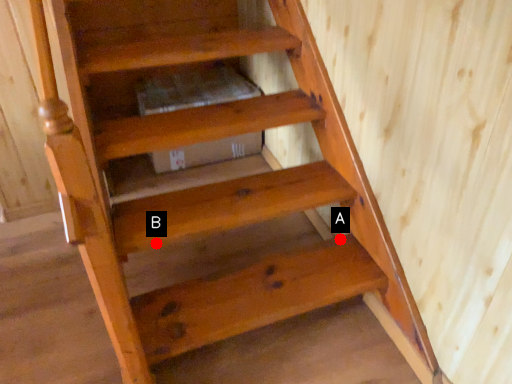
Question: Two points are circled on the image, labeled by A and B beside each circle. Which point is further to the camera?

Choices:
 (A) A is further
 (B) B is further

Answer: (A)